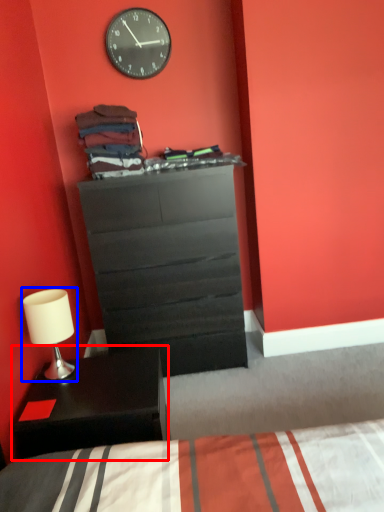
Question: Which of the following is the closest to the observer, nightstand (highlighted by a red box) or table lamp (highlighted by a blue box)?

Choices:
 (A) nightstand
 (B) table lamp

Answer: (A)